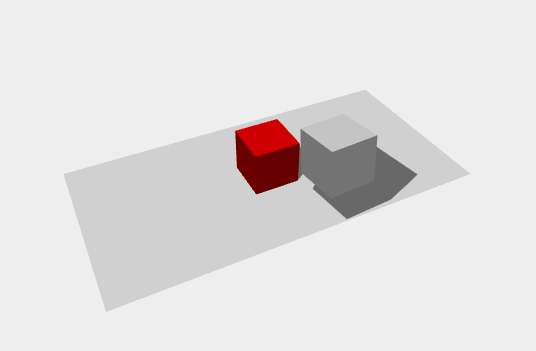
This screenshot has width=536, height=351. Find the location of `shadow box`. shadow box is located at coordinates pos(386,192).